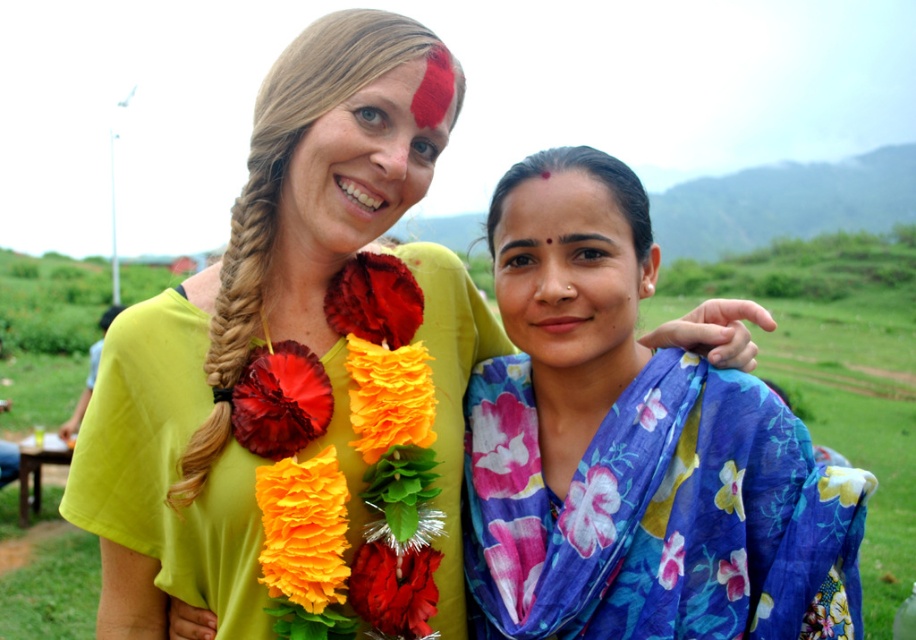
This screenshot has width=916, height=640. What do you see at coordinates (569, 275) in the screenshot?
I see `floral fabric scarf at center` at bounding box center [569, 275].

Can you confirm if floral fabric scarf at center is positioned to the right of matte yellow shirt at upper center?

Indeed, floral fabric scarf at center is positioned on the right side of matte yellow shirt at upper center.

Which is in front, point (521, 225) or point (406, 72)?

Positioned in front is point (406, 72).

Locate an element on the screen. floral fabric scarf at center is located at coordinates (569, 275).

Can you confirm if floral scarf at center is wider than floral fabric scarf at upper center?

Incorrect, floral scarf at center's width does not surpass floral fabric scarf at upper center's.

Which is below, floral scarf at center or floral fabric scarf at upper center?

floral fabric scarf at upper center is lower down.

The width and height of the screenshot is (916, 640). What do you see at coordinates (631, 449) in the screenshot?
I see `floral scarf at center` at bounding box center [631, 449].

You are a GUI agent. You are given a task and a screenshot of the screen. Output one action in this format:
    pyautogui.click(x=<x>, y=<y>)
    Task: Click on the floral scarf at center
    The height and width of the screenshot is (640, 916).
    Given the screenshot: What is the action you would take?
    pyautogui.click(x=631, y=449)

Is floral fabric scarf at upper center shorter than matte yellow shirt at upper center?

In fact, floral fabric scarf at upper center may be taller than matte yellow shirt at upper center.

Does floral fabric scarf at upper center appear under matte yellow shirt at upper center?

Yes, floral fabric scarf at upper center is below matte yellow shirt at upper center.

Which is behind, point (446, 394) or point (368, 108)?

The point (446, 394) is behind.

You are a GUI agent. You are given a task and a screenshot of the screen. Output one action in this format:
    pyautogui.click(x=<x>, y=<y>)
    Task: Click on the floral fabric scarf at upper center
    The image size is (916, 640).
    Given the screenshot: What is the action you would take?
    pyautogui.click(x=168, y=467)